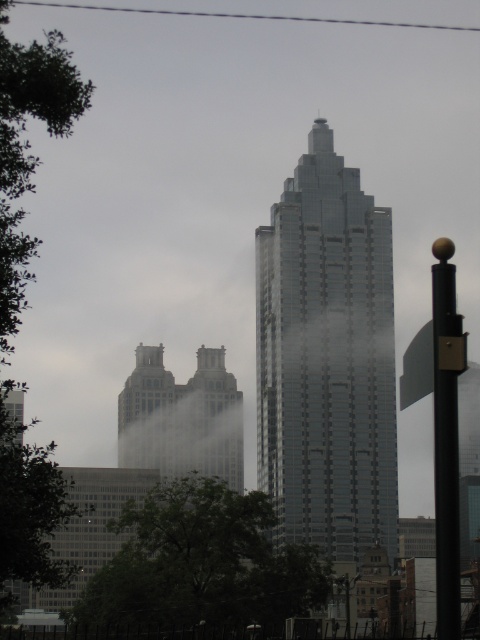
Question: Among these points, which one is nearest to the camera?

Choices:
 (A) click(451, 376)
 (B) click(322, 134)

Answer: (A)

Question: Estimate the real-world distances between objects in this image. Which object is closer to the black metal pole at right?

Choices:
 (A) glassy steel skyscraper at center
 (B) matte silver twin towers at center

Answer: (A)

Question: Is glassy steel skyscraper at center below matte silver twin towers at center?

Choices:
 (A) yes
 (B) no

Answer: (B)

Question: Is matte silver twin towers at center to the left of black metal pole at right from the viewer's perspective?

Choices:
 (A) yes
 (B) no

Answer: (A)

Question: Which object is the closest to the black metal pole at right?

Choices:
 (A) glassy steel skyscraper at center
 (B) matte silver twin towers at center

Answer: (A)

Question: Is the position of glassy steel skyscraper at center more distant than that of black metal pole at right?

Choices:
 (A) no
 (B) yes

Answer: (B)